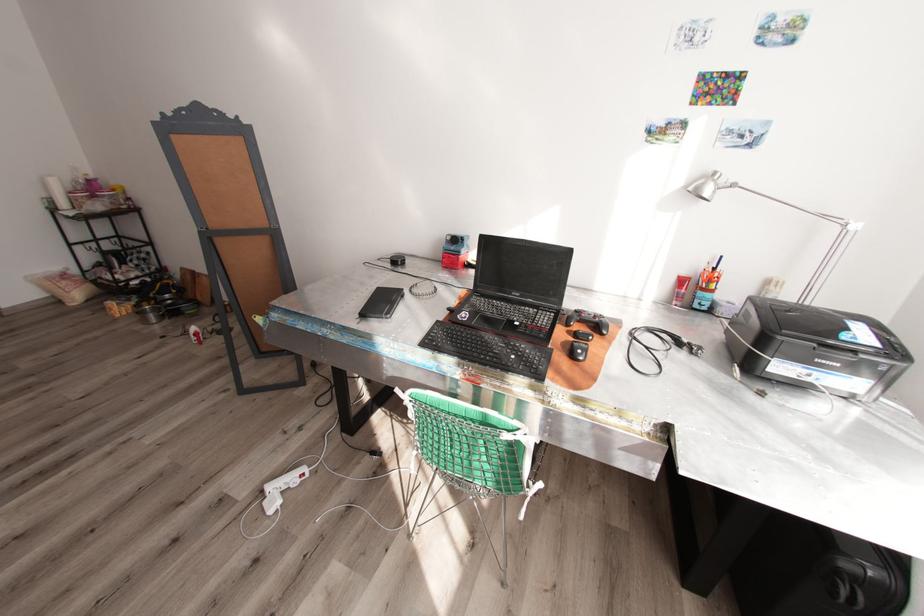
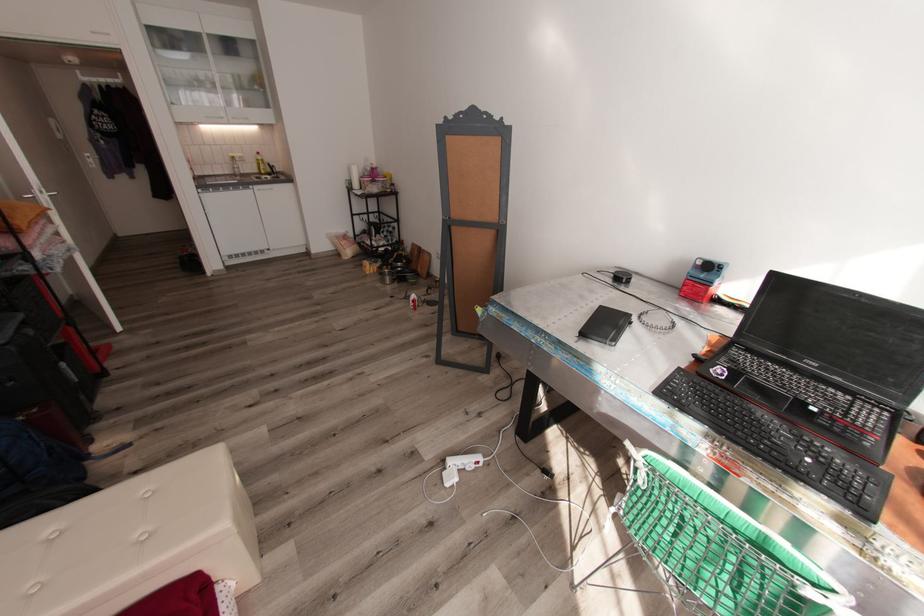
Question: The camera is either moving clockwise (left) or counter-clockwise (right) around the object. The first image is from the beginning of the video and the second image is from the end. Is the camera moving left or right when shooting the video?

Choices:
 (A) Left
 (B) Right

Answer: (B)